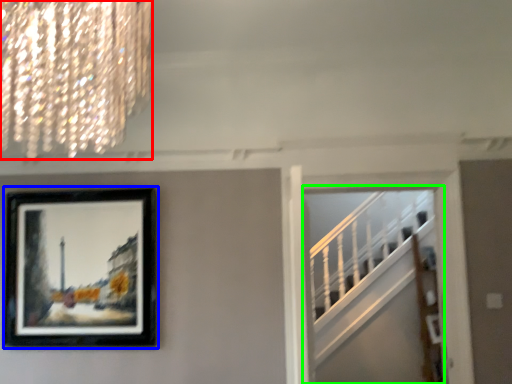
Question: Which is farther away from lamp (highlighted by a red box)? picture frame (highlighted by a blue box) or escalator (highlighted by a green box)?

Choices:
 (A) picture frame
 (B) escalator

Answer: (B)